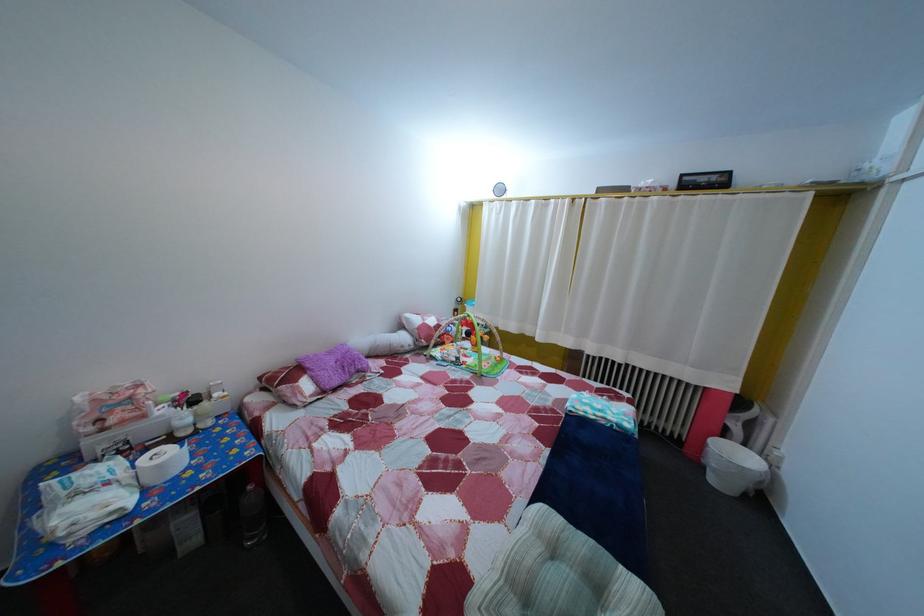
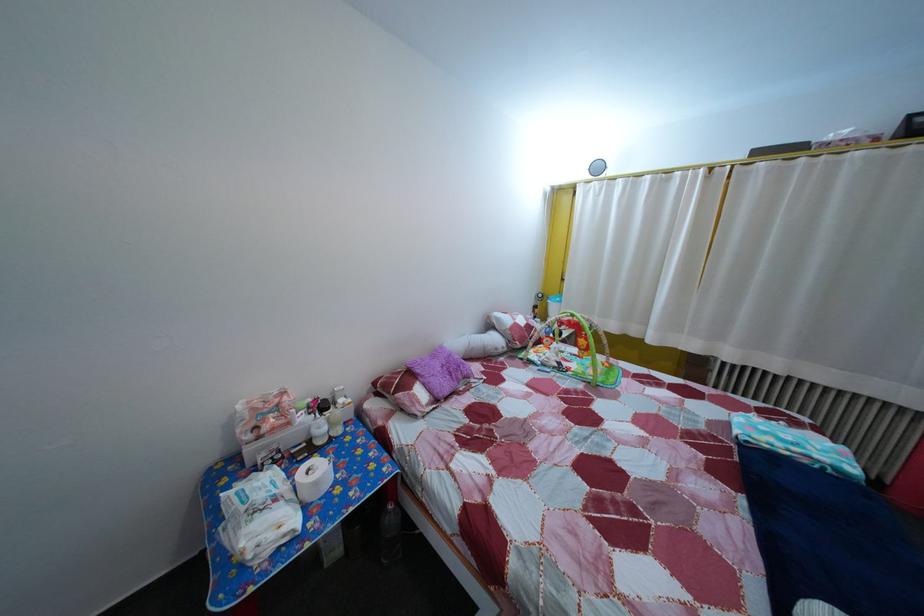
Find the pixel in the second image that matches (172,419) in the first image.

(311, 427)